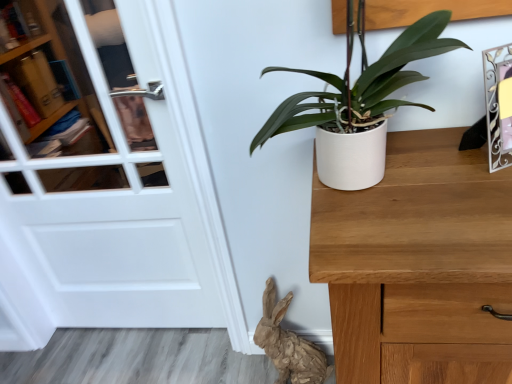
Describe the element at coordinates (288, 343) in the screenshot. I see `brown paper rabbit at lower center` at that location.

Where is `white glossy door at left`? white glossy door at left is located at coordinates (113, 228).

You are a GUI agent. You are given a task and a screenshot of the screen. Output one action in this format:
    pyautogui.click(x=<x>, y=<y>)
    Task: Click on the brown paper rabbit at lower center
    The width and height of the screenshot is (512, 384).
    Given the screenshot: What is the action you would take?
    pyautogui.click(x=288, y=343)

From the image's perspective, is white glossy door at left positioned above or below metallic silver picture frame at upper right?

white glossy door at left is below metallic silver picture frame at upper right.

Consider the image. Considering the positions of objects white glossy door at left and metallic silver picture frame at upper right in the image provided, who is more to the right, white glossy door at left or metallic silver picture frame at upper right?

metallic silver picture frame at upper right.

In the image, there is a metallic silver picture frame at upper right. Identify the location of door below it (from the image's perspective). coord(113,228).

Does brown paper rabbit at lower center turn towards metallic silver picture frame at upper right?

No, brown paper rabbit at lower center is not oriented towards metallic silver picture frame at upper right.

Can you confirm if brown paper rabbit at lower center is wider than metallic silver picture frame at upper right?

Yes.

I want to click on animal on the left of metallic silver picture frame at upper right, so click(x=288, y=343).

What's the angular difference between brown paper rabbit at lower center and metallic silver picture frame at upper right's facing directions?

The facing directions of brown paper rabbit at lower center and metallic silver picture frame at upper right are 23.6 degrees apart.

Which is in front, metallic silver picture frame at upper right or brown paper rabbit at lower center?

metallic silver picture frame at upper right.

From the image's perspective, which object appears higher, metallic silver picture frame at upper right or brown paper rabbit at lower center?

metallic silver picture frame at upper right is shown above in the image.

Does metallic silver picture frame at upper right have a greater height compared to brown paper rabbit at lower center?

No.

Is white glossy door at left with brown paper rabbit at lower center?

white glossy door at left and brown paper rabbit at lower center are not in contact.

Between white glossy door at left and brown paper rabbit at lower center, which one has smaller size?

brown paper rabbit at lower center is smaller.

Does white glossy door at left appear on the right side of brown paper rabbit at lower center?

In fact, white glossy door at left is to the left of brown paper rabbit at lower center.

From the image's perspective, is white glossy door at left located above brown paper rabbit at lower center?

Correct, white glossy door at left appears higher than brown paper rabbit at lower center in the image.

From the image's perspective, which is above, metallic silver picture frame at upper right or white matte pot at center-right?

From the image's view, white matte pot at center-right is above.

Would you say metallic silver picture frame at upper right is a long distance from white matte pot at center-right?

That's not correct — metallic silver picture frame at upper right is a little close to white matte pot at center-right.

From a real-world perspective, who is located higher, metallic silver picture frame at upper right or white matte pot at center-right?

In real-world perspective, white matte pot at center-right is above.

Between metallic silver picture frame at upper right and white matte pot at center-right, which one has larger width?

With larger width is white matte pot at center-right.

Measure the distance between white glossy door at left and white matte pot at center-right.

The distance of white glossy door at left from white matte pot at center-right is 28.44 inches.

Is white matte pot at center-right inside white glossy door at left?

No, white glossy door at left does not contain white matte pot at center-right.

Between point (158, 153) and point (351, 159), which one is positioned in front?

The point (351, 159) is more forward.

Looking at this image, are white glossy door at left and white matte pot at center-right far apart?

white glossy door at left is near white matte pot at center-right, not far away.

Is white matte pot at center-right positioned beyond the bounds of white glossy door at left?

Absolutely, white matte pot at center-right is external to white glossy door at left.

Is point (362, 47) in front of point (143, 214)?

That is True.

Does white matte pot at center-right have a lesser height compared to white glossy door at left?

Correct, white matte pot at center-right is not as tall as white glossy door at left.

Is white matte pot at center-right oriented away from white glossy door at left?

white matte pot at center-right is not turned away from white glossy door at left.

Identify the location of picture frame to the right of white glossy door at left. (496, 103).

Image resolution: width=512 pixels, height=384 pixels. Find the location of `picture frame above the brown paper rabbit at lower center (from the image's perspective)`. picture frame above the brown paper rabbit at lower center (from the image's perspective) is located at coordinates (496, 103).

Based on their spatial positions, is white matte pot at center-right or brown paper rabbit at lower center further from metallic silver picture frame at upper right?

brown paper rabbit at lower center lies further to metallic silver picture frame at upper right than the other object.

Looking at this image, estimate the real-world distances between objects in this image. Which object is further from metallic silver picture frame at upper right, white glossy door at left or white matte pot at center-right?

white glossy door at left is positioned further to the anchor metallic silver picture frame at upper right.

Estimate the real-world distances between objects in this image. Which object is further from metallic silver picture frame at upper right, brown paper rabbit at lower center or white glossy door at left?

Based on the image, white glossy door at left appears to be further to metallic silver picture frame at upper right.

Based on their spatial positions, is metallic silver picture frame at upper right or white glossy door at left further from white matte pot at center-right?

white glossy door at left lies further to white matte pot at center-right than the other object.

Based on their spatial positions, is white matte pot at center-right or metallic silver picture frame at upper right further from white glossy door at left?

metallic silver picture frame at upper right.

Based on their spatial positions, is white glossy door at left or metallic silver picture frame at upper right closer to brown paper rabbit at lower center?

Based on the image, white glossy door at left appears to be nearer to brown paper rabbit at lower center.

From the image, which object appears to be farther from brown paper rabbit at lower center, white glossy door at left or white matte pot at center-right?

white matte pot at center-right is positioned further to the anchor brown paper rabbit at lower center.

When comparing their distances from white matte pot at center-right, does brown paper rabbit at lower center or white glossy door at left seem closer?

white glossy door at left is closer to white matte pot at center-right.

Locate an element on the screen. The image size is (512, 384). picture frame between white matte pot at center-right and brown paper rabbit at lower center from top to bottom is located at coordinates (496, 103).

Locate an element on the screen. animal situated between white glossy door at left and metallic silver picture frame at upper right from left to right is located at coordinates (288, 343).

This screenshot has width=512, height=384. In order to click on animal between white glossy door at left and white matte pot at center-right in this screenshot , I will do `click(288, 343)`.

This screenshot has height=384, width=512. What are the coordinates of `houseplant between white glossy door at left and metallic silver picture frame at upper right from left to right` in the screenshot? It's located at (359, 107).